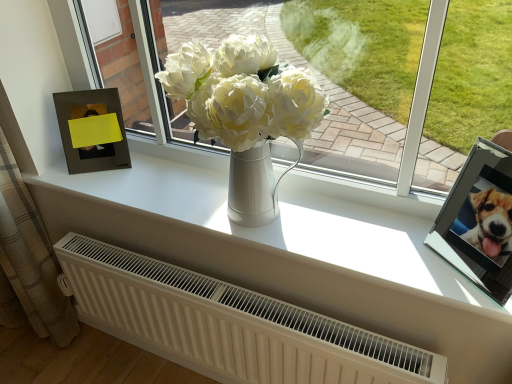
What is the approximate height of metallic silver picture frame at upper right, the 2th picture frame viewed from the back?

10.03 inches.

In order to click on matte brown picture frame at left, acting as the 1th picture frame starting from the left in this screenshot , I will do `click(92, 130)`.

Considering the positions of point (468, 180) and point (358, 100), is point (468, 180) closer or farther from the camera than point (358, 100)?

Clearly, point (468, 180) is closer to the camera than point (358, 100).

From a real-world perspective, is metallic silver picture frame at upper right, the 2th picture frame viewed from the back, physically located above or below white matte vase at center?

In terms of real-world spatial position, metallic silver picture frame at upper right, the 2th picture frame viewed from the back, is below white matte vase at center.

Is metallic silver picture frame at upper right, the 2th picture frame when ordered from left to right, to the right of white matte vase at center from the viewer's perspective?

Correct, you'll find metallic silver picture frame at upper right, the 2th picture frame when ordered from left to right, to the right of white matte vase at center.

Is the position of metallic silver picture frame at upper right, the 2th picture frame viewed from the back, more distant than that of white matte vase at center?

No.

Does point (343, 369) come farther from viewer compared to point (385, 214)?

No, it is not.

Is white matte radiator at lower center next to white matte vase at center?

No, white matte radiator at lower center is not with white matte vase at center.

Is white matte radiator at lower center thinner than white matte vase at center?

Correct, the width of white matte radiator at lower center is less than that of white matte vase at center.

There is a white matte radiator at lower center. Where is `window above it (from a real-world perspective)`? This screenshot has height=384, width=512. window above it (from a real-world perspective) is located at coordinates (465, 90).

Could you tell me if white matte radiator at lower center is turned towards white matte vase at center?

No, white matte radiator at lower center is not aimed at white matte vase at center.

Considering the sizes of white matte radiator at lower center and white matte vase at center in the image, is white matte radiator at lower center taller or shorter than white matte vase at center?

Clearly, white matte radiator at lower center is shorter compared to white matte vase at center.

Between point (160, 295) and point (168, 21), which one is positioned in front?

The point (160, 295) is closer to the camera.

From the image's perspective, is white matte vase at center located beneath white matte vase at center?

Incorrect, from the image's perspective, white matte vase at center is higher than white matte vase at center.

Is white matte vase at center turned away from white matte vase at center?

No, white matte vase at center is not facing away from white matte vase at center.

In the image, is white matte vase at center positioned in front of or behind white matte vase at center?

white matte vase at center is in front of white matte vase at center.

From a real-world perspective, which object rests below the other?

white matte radiator at lower center, from a real-world perspective.

Is white matte radiator at lower center taller or shorter than plaid fabric curtain at left?

Clearly, white matte radiator at lower center is shorter compared to plaid fabric curtain at left.

Considering the relative positions of white matte radiator at lower center and plaid fabric curtain at left in the image provided, is white matte radiator at lower center behind plaid fabric curtain at left?

That is False.

Is white matte radiator at lower center completely or partially outside of plaid fabric curtain at left?

Absolutely, white matte radiator at lower center is external to plaid fabric curtain at left.

Considering the relative positions of white matte vase at center and matte brown picture frame at left, which is the second picture frame in front-to-back order, in the image provided, is white matte vase at center behind matte brown picture frame at left, which is the second picture frame in front-to-back order,?

No, it is in front of matte brown picture frame at left, which is the second picture frame in front-to-back order.

Is white matte vase at center to the left of matte brown picture frame at left, the 1th picture frame viewed from the back, from the viewer's perspective?

No, white matte vase at center is not to the left of matte brown picture frame at left, the 1th picture frame viewed from the back.

From a real-world perspective, does white matte vase at center sit lower than matte brown picture frame at left, which is the second picture frame in front-to-back order?

Indeed, from a real-world perspective, white matte vase at center is positioned beneath matte brown picture frame at left, which is the second picture frame in front-to-back order.

Considering the sizes of plaid fabric curtain at left and white matte radiator at lower center in the image, is plaid fabric curtain at left wider or thinner than white matte radiator at lower center?

Considering their sizes, plaid fabric curtain at left looks broader than white matte radiator at lower center.

Is plaid fabric curtain at left next to white matte radiator at lower center and touching it?

No, plaid fabric curtain at left is not making contact with white matte radiator at lower center.

From a real-world perspective, relative to white matte radiator at lower center, is plaid fabric curtain at left vertically above or below?

In terms of real-world spatial position, plaid fabric curtain at left is above white matte radiator at lower center.

Which object is more forward, plaid fabric curtain at left or white matte radiator at lower center?

white matte radiator at lower center is closer to the camera.

Identify the location of window behind the metallic silver picture frame at upper right, the 1th picture frame in the right-to-left sequence. (465, 90).

Where is `window sill lying above the white matte radiator at lower center (from the image's perspective)`? The width and height of the screenshot is (512, 384). window sill lying above the white matte radiator at lower center (from the image's perspective) is located at coordinates (286, 219).

Looking at this image, considering their positions, is metallic silver picture frame at upper right, the 2th picture frame viewed from the back, positioned further to white matte vase at center than matte brown picture frame at left, the 1th picture frame viewed from the back?

Based on the image, metallic silver picture frame at upper right, the 2th picture frame viewed from the back, appears to be further to white matte vase at center.

From the image, which object appears to be nearer to metallic silver picture frame at upper right, the 2th picture frame viewed from the back, white matte radiator at lower center or white matte vase at center?

white matte vase at center.

Considering their positions, is white matte radiator at lower center positioned closer to white matte vase at center than plaid fabric curtain at left?

white matte radiator at lower center is positioned closer to the anchor white matte vase at center.

When comparing their distances from white matte vase at center, does matte brown picture frame at left, the 1th picture frame viewed from the back, or plaid fabric curtain at left seem further?

Among the two, plaid fabric curtain at left is located further to white matte vase at center.

Estimate the real-world distances between objects in this image. Which object is further from white matte vase at center, matte brown picture frame at left, acting as the 1th picture frame starting from the left, or metallic silver picture frame at upper right, the 2th picture frame when ordered from left to right?

Based on the image, metallic silver picture frame at upper right, the 2th picture frame when ordered from left to right, appears to be further to white matte vase at center.

Based on their spatial positions, is plaid fabric curtain at left or white matte radiator at lower center further from white matte vase at center?

The object further to white matte vase at center is plaid fabric curtain at left.

From the image, which object appears to be farther from matte brown picture frame at left, acting as the 1th picture frame starting from the left, plaid fabric curtain at left or metallic silver picture frame at upper right, the 2th picture frame viewed from the back?

Among the two, metallic silver picture frame at upper right, the 2th picture frame viewed from the back, is located further to matte brown picture frame at left, acting as the 1th picture frame starting from the left.

Looking at the image, which one is located further to metallic silver picture frame at upper right, the 2th picture frame when ordered from left to right, white matte radiator at lower center or white matte vase at center?

The object further to metallic silver picture frame at upper right, the 2th picture frame when ordered from left to right, is white matte vase at center.

What are the coordinates of `radiator situated between plaid fabric curtain at left and white matte vase at center from left to right` in the screenshot? It's located at (228, 324).

The height and width of the screenshot is (384, 512). Identify the location of window between matte brown picture frame at left, acting as the 1th picture frame starting from the left, and metallic silver picture frame at upper right, which is the 1th picture frame from front to back, in the horizontal direction. pos(465,90).

The image size is (512, 384). In order to click on window sill between matte brown picture frame at left, positioned as the second picture frame in right-to-left order, and white matte vase at center, in the horizontal direction in this screenshot , I will do `click(286, 219)`.

Find the location of `window sill between matte brown picture frame at left, the 1th picture frame viewed from the back, and metallic silver picture frame at upper right, the 2th picture frame when ordered from left to right, in the horizontal direction`. window sill between matte brown picture frame at left, the 1th picture frame viewed from the back, and metallic silver picture frame at upper right, the 2th picture frame when ordered from left to right, in the horizontal direction is located at coordinates (286, 219).